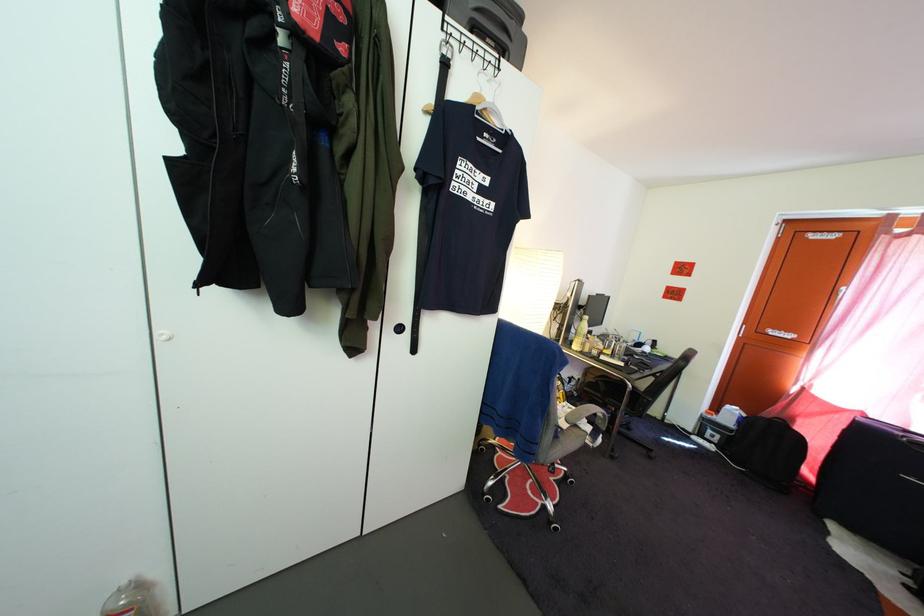
Image resolution: width=924 pixels, height=616 pixels. What do you see at coordinates (163, 336) in the screenshot?
I see `the white cabinet knob` at bounding box center [163, 336].